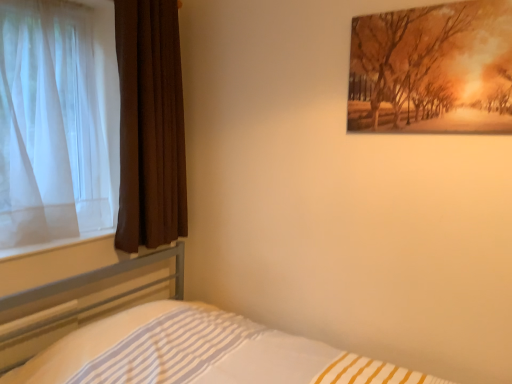
Question: From a real-world perspective, does matte orange painting at upper right sit lower than white striped fabric at lower left?

Choices:
 (A) yes
 (B) no

Answer: (B)

Question: Does matte orange painting at upper right appear on the left side of white striped fabric at lower left?

Choices:
 (A) no
 (B) yes

Answer: (A)

Question: Can you confirm if matte orange painting at upper right is thinner than white striped fabric at lower left?

Choices:
 (A) yes
 (B) no

Answer: (A)

Question: From a real-world perspective, is matte orange painting at upper right on top of white striped fabric at lower left?

Choices:
 (A) yes
 (B) no

Answer: (A)

Question: Is the depth of matte orange painting at upper right less than that of white striped fabric at lower left?

Choices:
 (A) yes
 (B) no

Answer: (B)

Question: From a real-world perspective, relative to white striped fabric at lower left, is brown velvet curtain at left, which ranks as the second curtain in left-to-right order, vertically above or below?

Choices:
 (A) above
 (B) below

Answer: (A)

Question: In the image, is brown velvet curtain at left, the 1th curtain positioned from the right, positioned in front of or behind white striped fabric at lower left?

Choices:
 (A) behind
 (B) front

Answer: (A)

Question: From the image's perspective, is brown velvet curtain at left, the 1th curtain positioned from the right, above or below white striped fabric at lower left?

Choices:
 (A) below
 (B) above

Answer: (B)

Question: Is point (142, 182) closer or farther from the camera than point (103, 317)?

Choices:
 (A) closer
 (B) farther

Answer: (B)

Question: Is white striped fabric at lower left inside or outside of white sheer curtain at left, which is counted as the 2th curtain, starting from the right?

Choices:
 (A) outside
 (B) inside

Answer: (A)

Question: In terms of height, does white striped fabric at lower left look taller or shorter compared to white sheer curtain at left, the 1th curtain when ordered from left to right?

Choices:
 (A) short
 (B) tall

Answer: (A)

Question: In the image, is white striped fabric at lower left on the left side or the right side of white sheer curtain at left, the 1th curtain when ordered from left to right?

Choices:
 (A) right
 (B) left

Answer: (A)

Question: Considering the positions of point (49, 301) and point (54, 99), is point (49, 301) closer or farther from the camera than point (54, 99)?

Choices:
 (A) farther
 (B) closer

Answer: (B)

Question: Is white striped fabric at lower left taller or shorter than matte orange painting at upper right?

Choices:
 (A) tall
 (B) short

Answer: (A)

Question: Is white striped fabric at lower left to the left or to the right of matte orange painting at upper right in the image?

Choices:
 (A) right
 (B) left

Answer: (B)